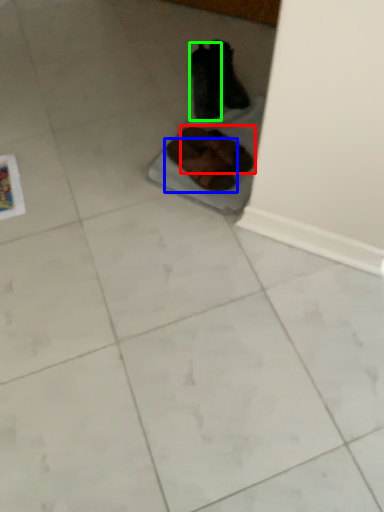
Question: Considering the real-world distances, which object is farthest from footwear (highlighted by a red box)? footwear (highlighted by a blue box) or footwear (highlighted by a green box)?

Choices:
 (A) footwear
 (B) footwear

Answer: (B)